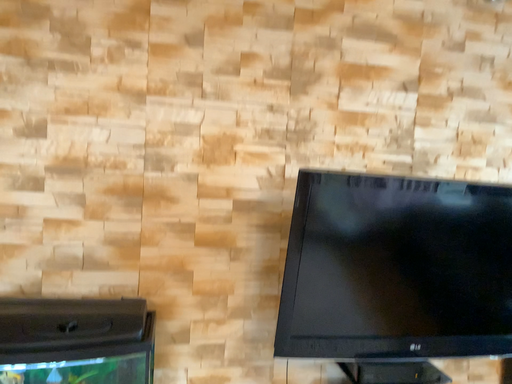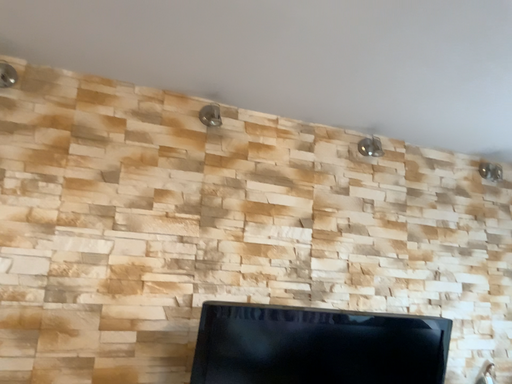
Question: How did the camera likely rotate when shooting the video?

Choices:
 (A) rotated left
 (B) rotated right

Answer: (B)